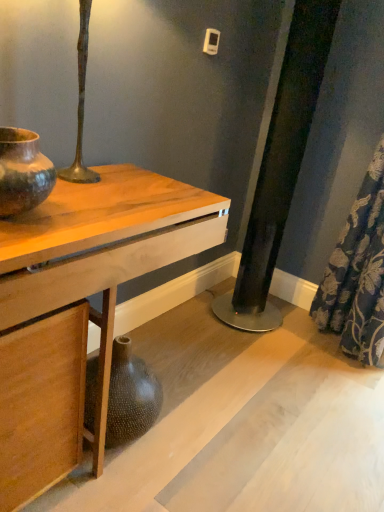
Question: Is blue floral fabric at lower right wider than wooden table at center?

Choices:
 (A) yes
 (B) no

Answer: (B)

Question: Does blue floral fabric at lower right appear on the left side of wooden table at center?

Choices:
 (A) no
 (B) yes

Answer: (A)

Question: Can you see blue floral fabric at lower right touching wooden table at center?

Choices:
 (A) yes
 (B) no

Answer: (B)

Question: Is blue floral fabric at lower right to the right of wooden table at center from the viewer's perspective?

Choices:
 (A) no
 (B) yes

Answer: (B)

Question: From a real-world perspective, is blue floral fabric at lower right physically above wooden table at center?

Choices:
 (A) no
 (B) yes

Answer: (B)

Question: Considering the relative sizes of blue floral fabric at lower right and wooden table at center in the image provided, is blue floral fabric at lower right shorter than wooden table at center?

Choices:
 (A) yes
 (B) no

Answer: (B)

Question: Is wooden table at center surrounding matte brown ceramic vase at left?

Choices:
 (A) yes
 (B) no

Answer: (B)

Question: Considering the relative sizes of wooden table at center and matte brown ceramic vase at left in the image provided, is wooden table at center wider than matte brown ceramic vase at left?

Choices:
 (A) yes
 (B) no

Answer: (A)

Question: Is wooden table at center outside of matte brown ceramic vase at left?

Choices:
 (A) no
 (B) yes

Answer: (B)

Question: Does wooden table at center appear on the left side of matte brown ceramic vase at left?

Choices:
 (A) no
 (B) yes

Answer: (A)

Question: Considering the relative sizes of wooden table at center and matte brown ceramic vase at left in the image provided, is wooden table at center shorter than matte brown ceramic vase at left?

Choices:
 (A) yes
 (B) no

Answer: (B)

Question: From the image's perspective, does wooden table at center appear lower than matte brown ceramic vase at left?

Choices:
 (A) yes
 (B) no

Answer: (A)

Question: Considering the relative positions of matte brown ceramic vase at left and wooden table at center in the image provided, is matte brown ceramic vase at left to the left of wooden table at center from the viewer's perspective?

Choices:
 (A) yes
 (B) no

Answer: (A)